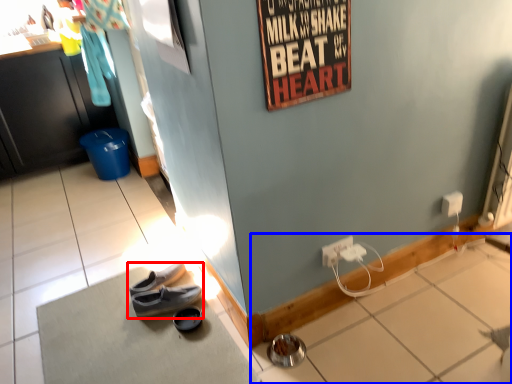
Question: Which of the following is the farthest to the observer, footwear (highlighted by a red box) or tile (highlighted by a blue box)?

Choices:
 (A) footwear
 (B) tile

Answer: (A)